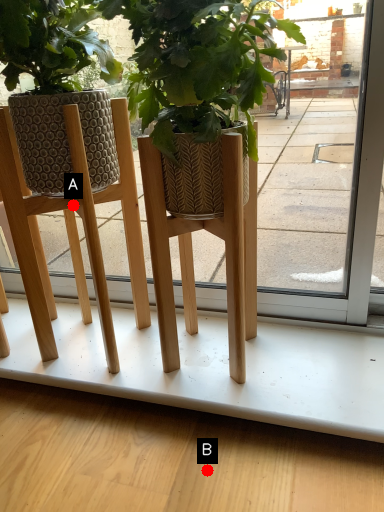
Question: Two points are circled on the image, labeled by A and B beside each circle. Among these points, which one is nearest to the camera?

Choices:
 (A) A is closer
 (B) B is closer

Answer: (B)